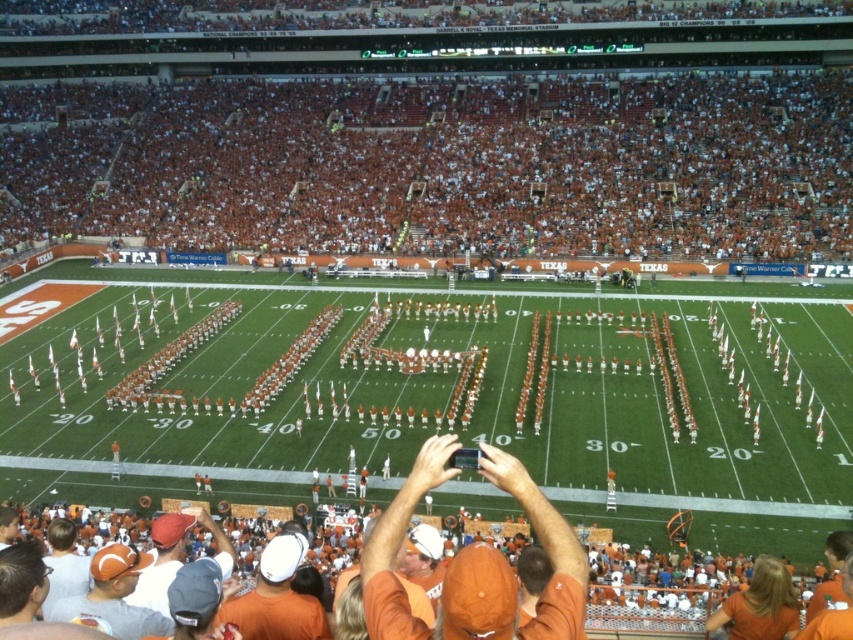
You are a photographer at the stadium and want to capture both the orange cotton shirt at center and the orange cotton shirt at lower left in a single photo. Which shirt should you focus on first to ensure both are in frame?

You should focus on the orange cotton shirt at center first because it is larger and will require more space in the frame, ensuring the smaller orange cotton shirt at lower left can fit alongside it.

You are a photographer standing at the center of the field. You want to take a photo of the orange cotton shirt at center. Where should you point your camera?

The orange cotton shirt at center is located at point 0.894 on the x axis and 0.601 on the y axis, so you should point your camera towards those coordinates to capture it.